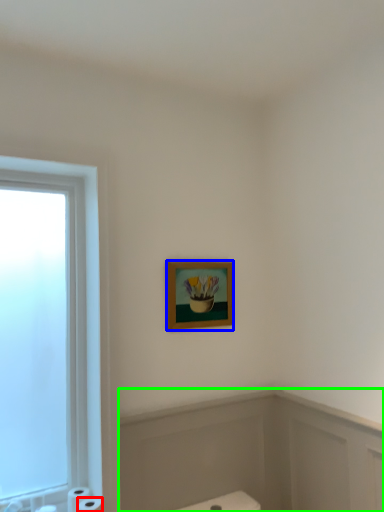
Question: Which object is positioned farthest from toilet paper (highlighted by a red box)? Select from picture frame (highlighted by a blue box) and bath (highlighted by a green box).

Choices:
 (A) picture frame
 (B) bath

Answer: (A)